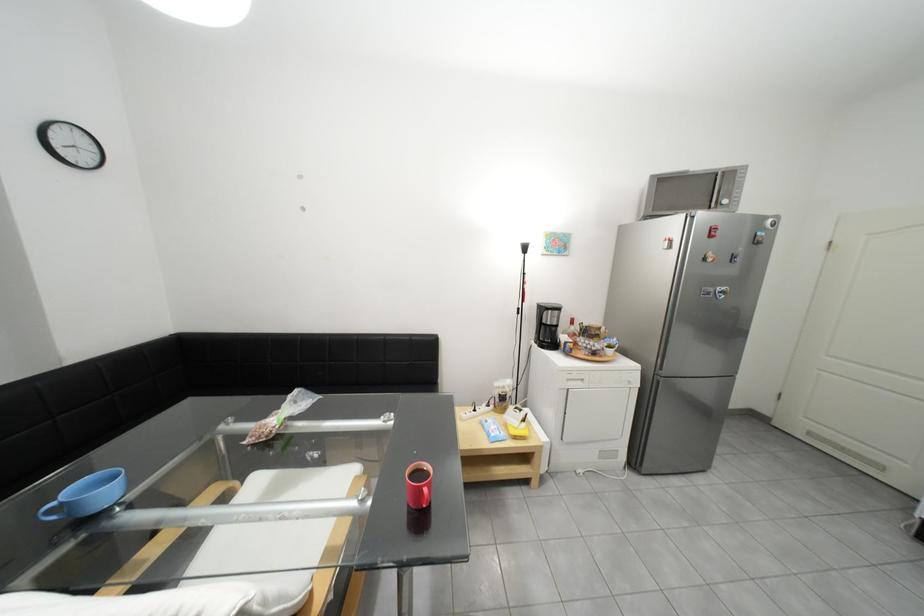
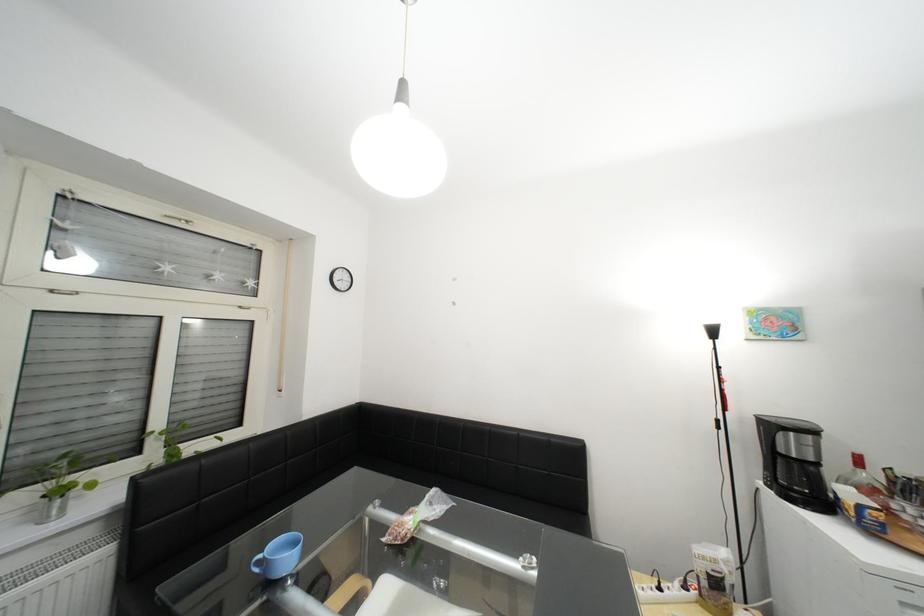
Where in the second image is the point corresponding to the point at 579,355 from the first image?

(886, 533)